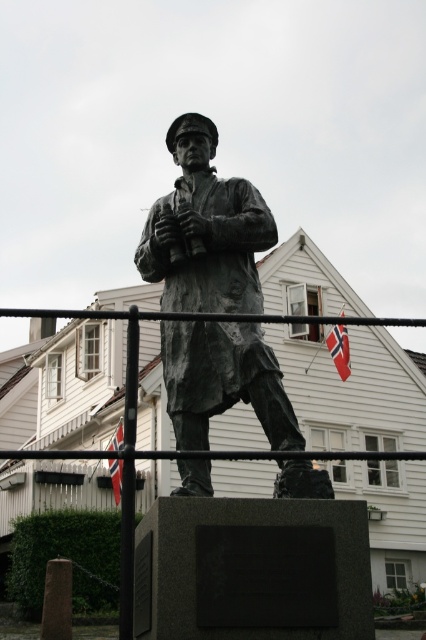
Can you confirm if bronze statue at center is positioned to the left of red fabric flag at center?

No, bronze statue at center is not to the left of red fabric flag at center.

Looking at this image, can you confirm if bronze statue at center is positioned to the right of red fabric flag at center?

Indeed, bronze statue at center is positioned on the right side of red fabric flag at center.

Image resolution: width=426 pixels, height=640 pixels. What are the coordinates of `bronze statue at center` in the screenshot? It's located at (204, 230).

Between point (327, 346) and point (118, 502), which one is positioned in front?

Point (118, 502) is in front.

Does white fabric flag at upper center have a larger size compared to red fabric flag at center?

Incorrect, white fabric flag at upper center is not larger than red fabric flag at center.

Between point (339, 376) and point (114, 474), which one is positioned in front?

Positioned in front is point (114, 474).

Identify the location of white fabric flag at upper center. (339, 348).

Who is more forward, (265,388) or (344,362)?

Positioned in front is point (265,388).

Between point (204, 406) and point (348, 349), which one is positioned behind?

Positioned behind is point (348, 349).

Image resolution: width=426 pixels, height=640 pixels. What are the coordinates of `bronze statue at center` in the screenshot? It's located at (204, 230).